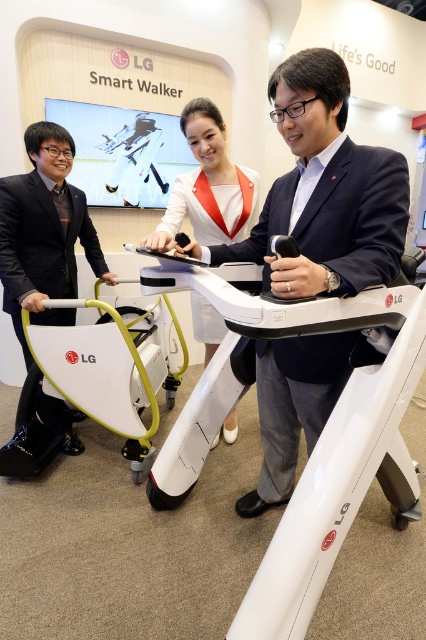
Who is more forward, (126, 394) or (8, 307)?

Point (126, 394) is more forward.

Between point (112, 388) and point (49, 422), which one is positioned behind?

The point (49, 422) is behind.

Find the location of a particular element. white plastic walker at center is located at coordinates (98, 380).

Does white plastic walker at center have a larger size compared to white fabric dress at center?

Yes.

Can you confirm if white plastic walker at center is thinner than white fabric dress at center?

Incorrect, white plastic walker at center's width is not less than white fabric dress at center's.

Is point (155, 378) less distant than point (193, 147)?

No, it is not.

Image resolution: width=426 pixels, height=640 pixels. Find the location of `white plastic walker at center`. white plastic walker at center is located at coordinates (98, 380).

Can you confirm if dark blue fabric business suit at center is smaller than white fabric dress at center?

Incorrect, dark blue fabric business suit at center is not smaller in size than white fabric dress at center.

Can you confirm if dark blue fabric business suit at center is positioned to the right of white fabric dress at center?

Indeed, dark blue fabric business suit at center is positioned on the right side of white fabric dress at center.

The image size is (426, 640). What do you see at coordinates (336, 216) in the screenshot?
I see `dark blue fabric business suit at center` at bounding box center [336, 216].

Where is `dark blue fabric business suit at center`? This screenshot has height=640, width=426. dark blue fabric business suit at center is located at coordinates (336, 216).